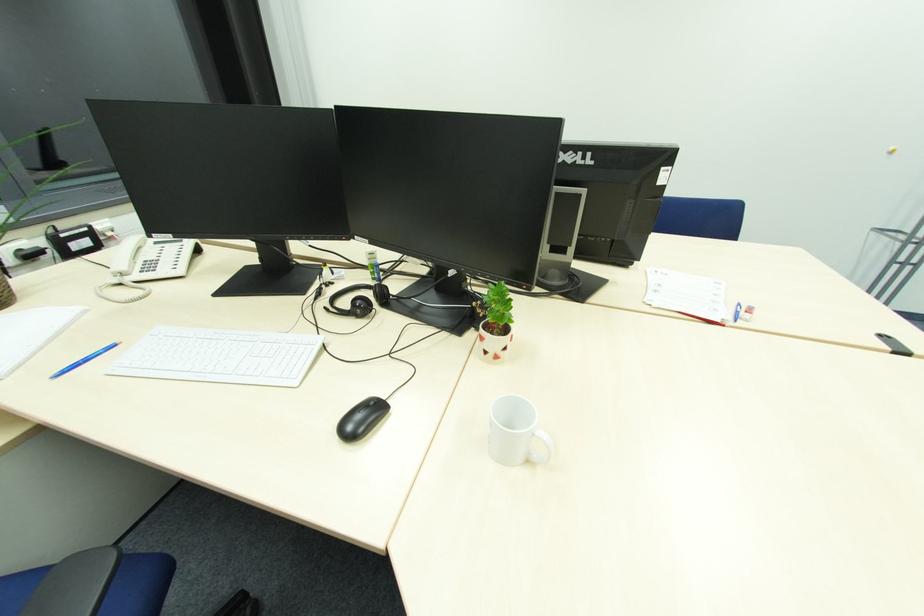
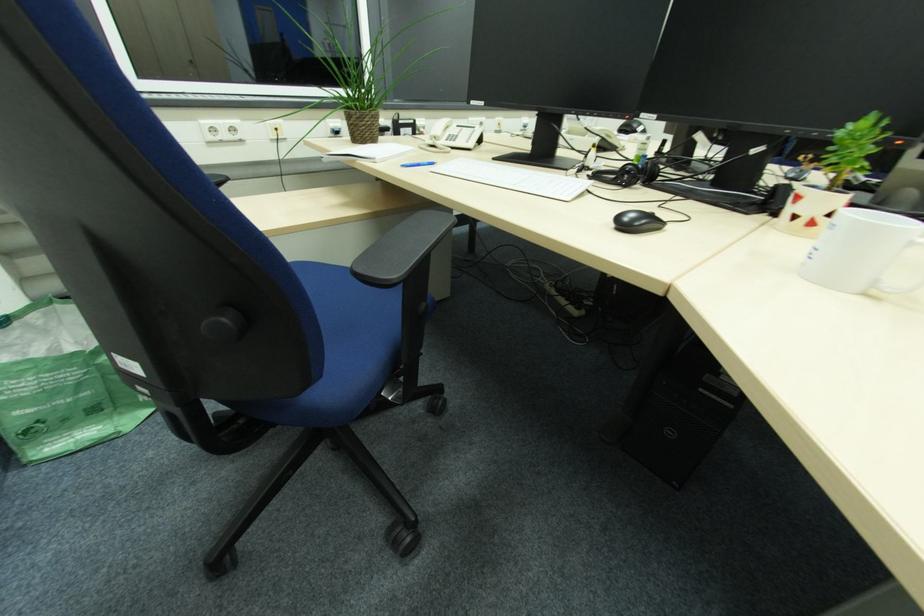
Question: How did the camera likely rotate?

Choices:
 (A) Left
 (B) Right
 (C) Up
 (D) Down

Answer: (A)